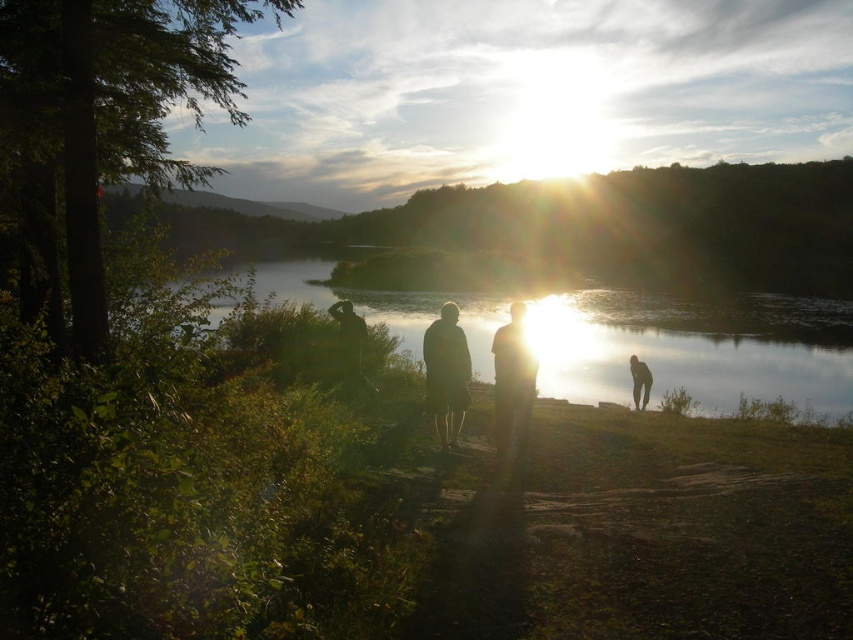
Based on the photo, who is taller, silhouette figure at center or smooth skin person at lower right?

Standing taller between the two is silhouette figure at center.

At what (x,y) coordinates should I click in order to perform the action: click on silhouette figure at center. Please return your answer as a coordinate pair (x, y). The width and height of the screenshot is (853, 640). Looking at the image, I should click on (512, 381).

Is silhouette figure at center to the right of dark gray fabric jacket at center from the viewer's perspective?

Indeed, silhouette figure at center is positioned on the right side of dark gray fabric jacket at center.

Is point (502, 381) in front of point (460, 360)?

Yes, it is.

Between point (508, 417) and point (442, 406), which one is positioned in front?

Positioned in front is point (508, 417).

I want to click on silhouette figure at center, so click(512, 381).

The image size is (853, 640). What do you see at coordinates (694, 346) in the screenshot?
I see `glistening reflective water at center` at bounding box center [694, 346].

Does glistening reflective water at center have a lesser width compared to silhouette figure at center?

No.

Image resolution: width=853 pixels, height=640 pixels. What do you see at coordinates (694, 346) in the screenshot?
I see `glistening reflective water at center` at bounding box center [694, 346].

I want to click on glistening reflective water at center, so click(694, 346).